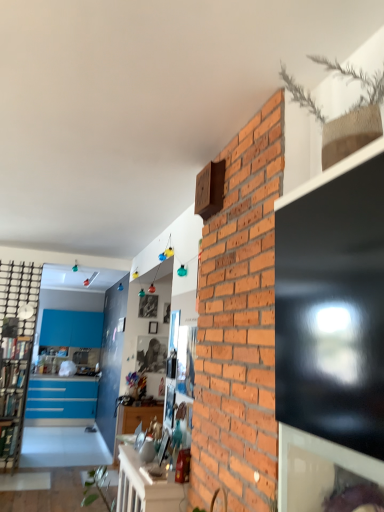
Question: Is black metal bookshelf at left facing towards white glossy table at lower center?

Choices:
 (A) yes
 (B) no

Answer: (B)

Question: Does black metal bookshelf at left lie behind white glossy table at lower center?

Choices:
 (A) yes
 (B) no

Answer: (A)

Question: From a real-world perspective, is black metal bookshelf at left under white glossy table at lower center?

Choices:
 (A) yes
 (B) no

Answer: (B)

Question: Can you confirm if black metal bookshelf at left is shorter than white glossy table at lower center?

Choices:
 (A) yes
 (B) no

Answer: (B)

Question: Can you confirm if black metal bookshelf at left is taller than white glossy table at lower center?

Choices:
 (A) yes
 (B) no

Answer: (A)

Question: Is black metal bookshelf at left to the left of white glossy table at lower center from the viewer's perspective?

Choices:
 (A) no
 (B) yes

Answer: (B)

Question: Considering the relative sizes of white glossy table at lower center and black metal bookshelf at left in the image provided, is white glossy table at lower center thinner than black metal bookshelf at left?

Choices:
 (A) yes
 (B) no

Answer: (B)

Question: Does white glossy table at lower center contain black metal bookshelf at left?

Choices:
 (A) yes
 (B) no

Answer: (B)

Question: From a real-world perspective, is white glossy table at lower center located beneath black metal bookshelf at left?

Choices:
 (A) no
 (B) yes

Answer: (B)

Question: Does white glossy table at lower center have a lesser height compared to black metal bookshelf at left?

Choices:
 (A) yes
 (B) no

Answer: (A)

Question: Is white glossy table at lower center turned away from black metal bookshelf at left?

Choices:
 (A) yes
 (B) no

Answer: (B)

Question: Is white glossy table at lower center in front of black metal bookshelf at left?

Choices:
 (A) yes
 (B) no

Answer: (A)

Question: Considering their positions, is white glossy table at lower center located in front of or behind black metal bookshelf at left?

Choices:
 (A) behind
 (B) front

Answer: (B)